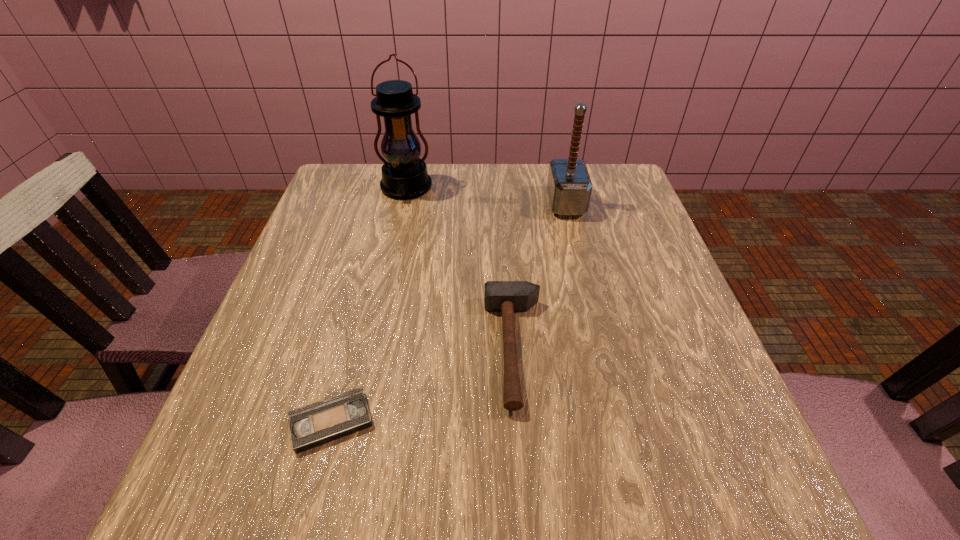
Where is `object that is the third closest one to the shortest object`? This screenshot has height=540, width=960. object that is the third closest one to the shortest object is located at coordinates (569, 186).